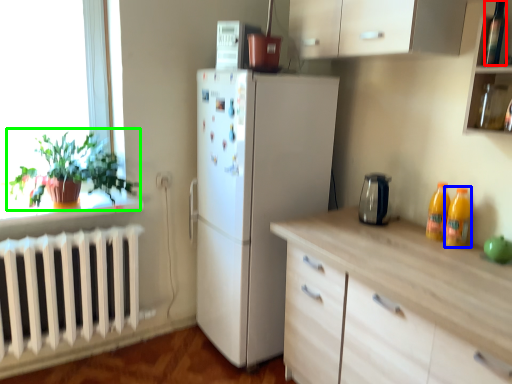
Question: Based on their relative distances, which object is farther from bottle (highlighted by a red box)? Choose from bottle (highlighted by a blue box) and houseplant (highlighted by a green box).

Choices:
 (A) bottle
 (B) houseplant

Answer: (B)